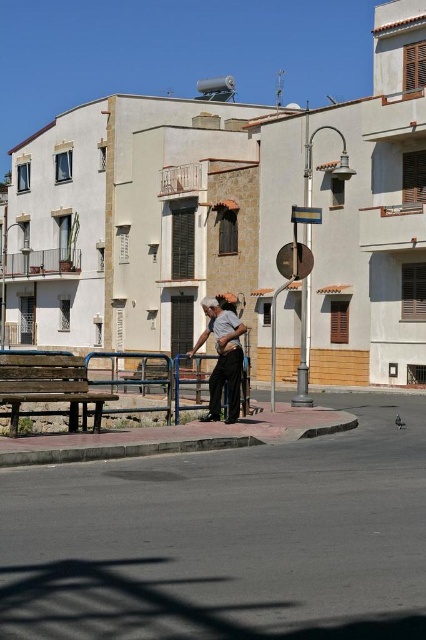
Consider the image. You are a tourist standing on the sidewalk and want to sit down. You see a wooden bench at lower left and dark gray fabric pants at center. Which object is closer to your current position?

The wooden bench at lower left is closer to your current position because it is to the left of dark gray fabric pants at center, implying it is nearer when facing the scene.

You are a tourist trying to find a place to sit while waiting for a friend. You see a wooden bench at lower left and dark gray fabric pants at center. Which object is shorter and can you sit on it?

The wooden bench at lower left is shorter than dark gray fabric pants at center. However, the dark gray fabric pants at center are likely clothing worn by a person, so you cannot sit on them. The wooden bench at lower left is the appropriate place to sit.

You are a person who wants to sit down. You see a wooden bench at lower left and dark gray fabric pants at center. Which one can you sit on?

The wooden bench at lower left can be sat on, while the dark gray fabric pants at center are clothing and cannot be sat on.